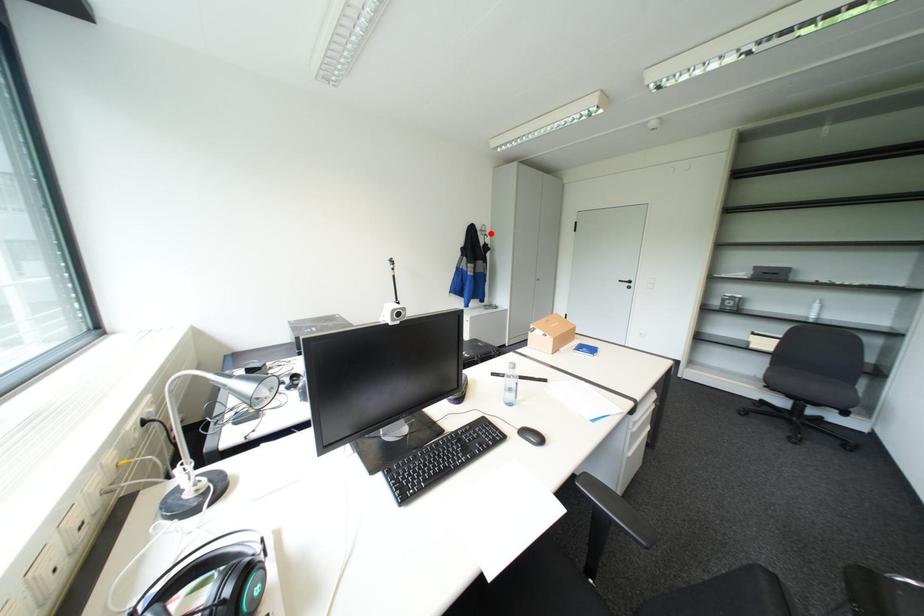
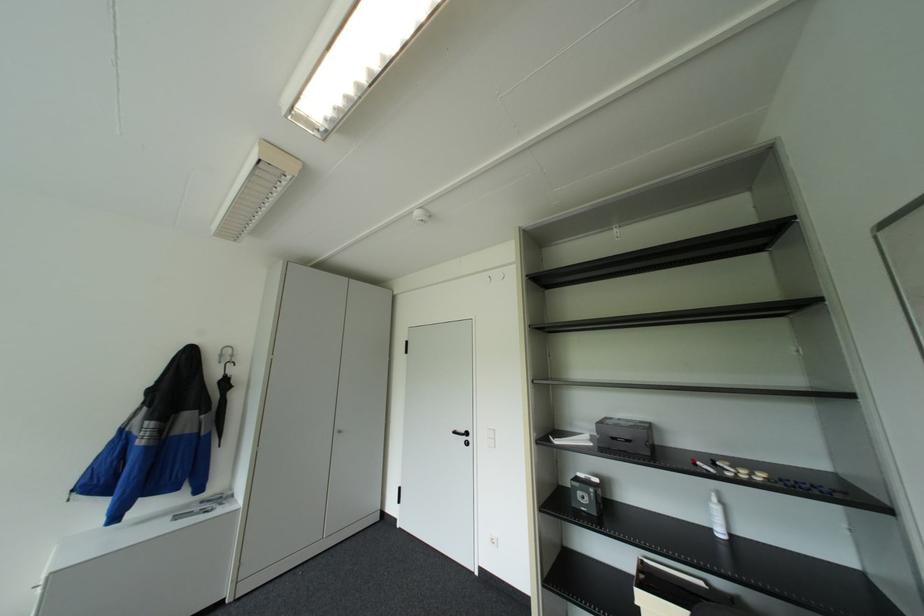
Question: I am providing you with two images of the same scene from different viewpoints. Image1 has a red point marked. In image2, the corresponding 3D location appears at what relative position? Reply with the corresponding letter.

Choices:
 (A) Closer
 (B) Farther

Answer: (B)